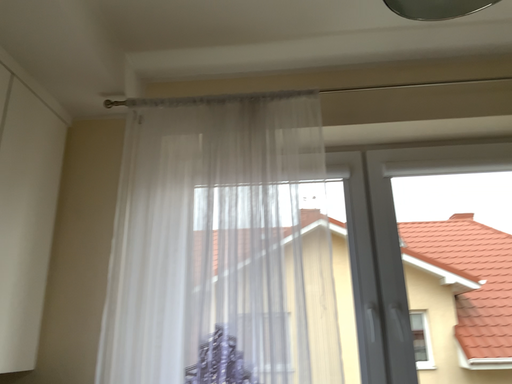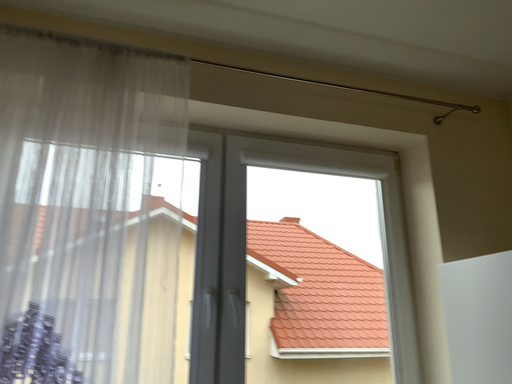
Question: Which way did the camera rotate in the video?

Choices:
 (A) rotated left
 (B) rotated right

Answer: (B)